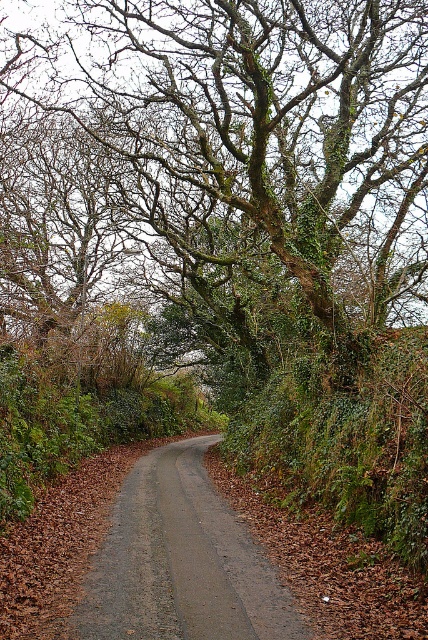
You are driving a car that is 2 meters wide and want to navigate through the gray gravel road at center. Considering the green mossy tree at upper center, will there be enough space for your car to pass through without hitting the tree?

The green mossy tree at upper center is wider than the gray gravel road at center, so there might not be enough space for the car to pass through without hitting the tree.